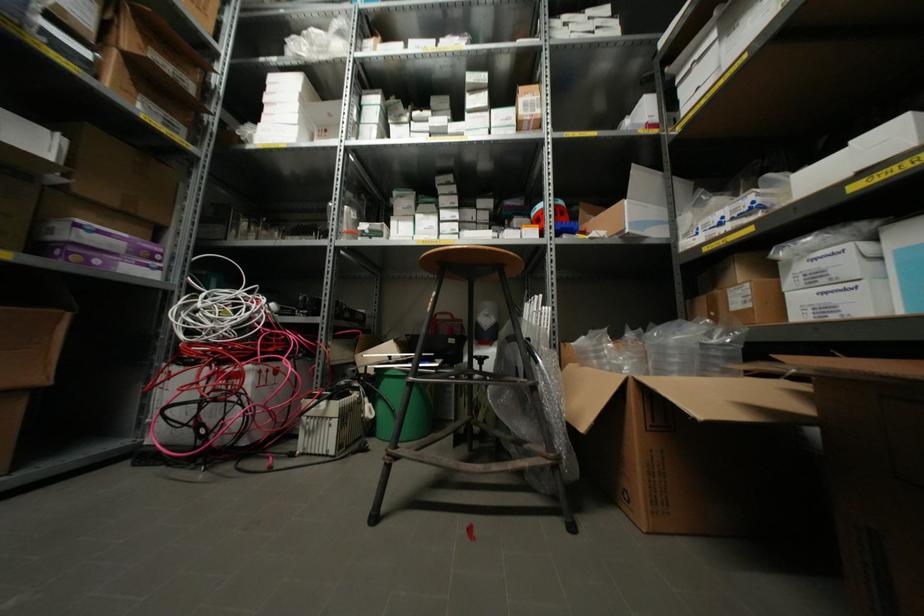
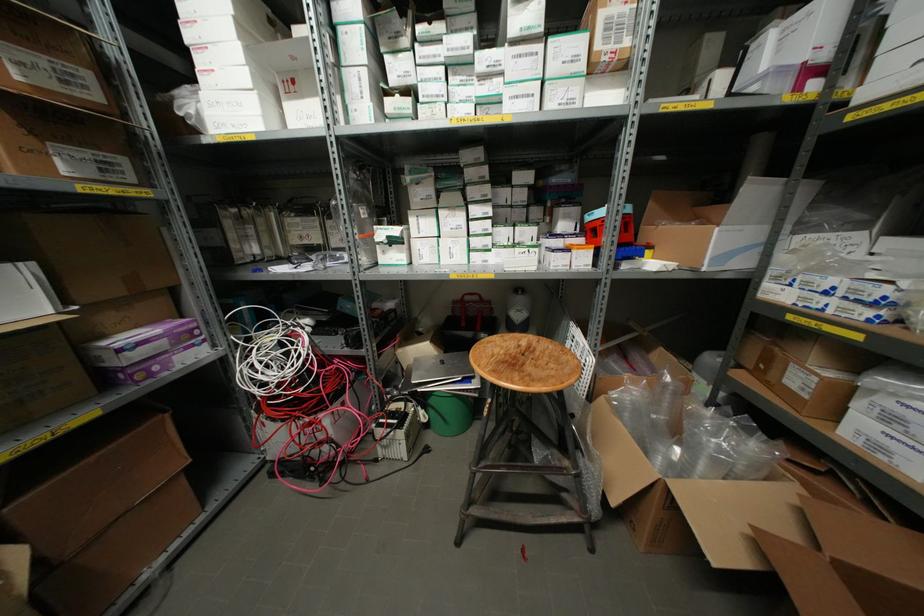
Find the pixel in the second image that matches point (392, 223) in the first image.

(410, 219)